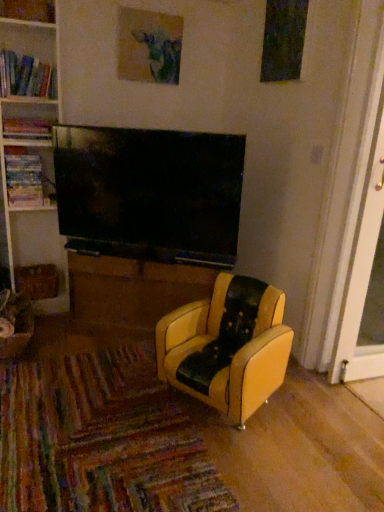
Question: Looking at their shapes, would you say brown wood table at center is wider or thinner than wooden bookshelf at upper left?

Choices:
 (A) thin
 (B) wide

Answer: (B)

Question: From a real-world perspective, is brown wood table at center above or below wooden bookshelf at upper left?

Choices:
 (A) below
 (B) above

Answer: (A)

Question: Which of these objects is positioned closest to the multicolored cardboard book at left, which is the first book in bottom-to-top order?

Choices:
 (A) wooden bookshelf at upper left
 (B) yellow leather chair at center
 (C) hardcover book at left, marked as the 2th book in a top-to-bottom arrangement
 (D) hardcover books at left, the 3th book positioned from the bottom
 (E) matte paper picture frame at upper center

Answer: (C)

Question: Which of these objects is positioned closest to the yellow leather chair at center?

Choices:
 (A) hardcover books at left, the 3th book positioned from the bottom
 (B) matte paper picture frame at upper center
 (C) wooden bookshelf at upper left
 (D) white plastic screen door at right
 (E) hardcover book at left, which appears as the 2th book when ordered from the bottom

Answer: (D)